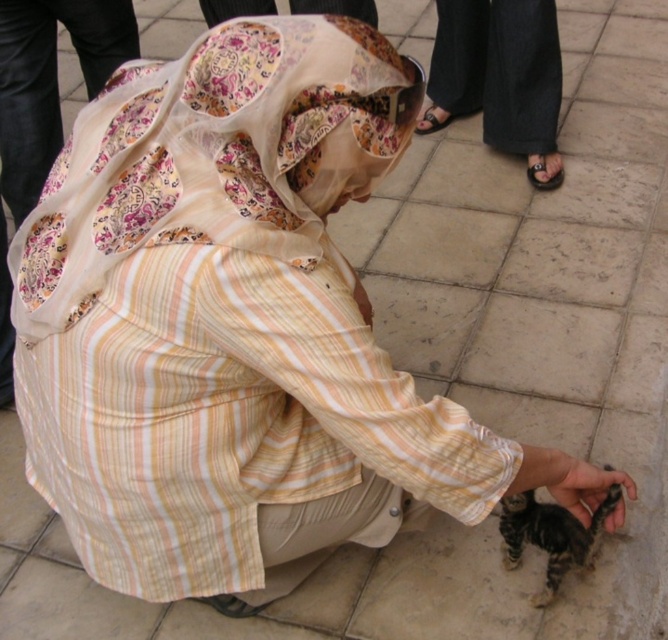
Which of these two, black cotton pants at upper center or soft fur paw at lower right, stands shorter?

soft fur paw at lower right is shorter.

Which is more to the left, black cotton pants at upper center or soft fur paw at lower right?

Positioned to the left is soft fur paw at lower right.

Is point (516, 129) farther from viewer compared to point (623, 477)?

Yes, it is behind point (623, 477).

Locate an element on the screen. The image size is (668, 640). black cotton pants at upper center is located at coordinates (498, 70).

Does point (566, 536) lie in front of point (587, 506)?

Yes, point (566, 536) is in front of point (587, 506).

Describe the element at coordinates (550, 536) in the screenshot. I see `striped fur kitten at lower right` at that location.

At what (x,y) coordinates should I click in order to perform the action: click on striped fur kitten at lower right. Please return your answer as a coordinate pair (x, y). The image size is (668, 640). Looking at the image, I should click on (550, 536).

Is point (442, 106) in front of point (548, 154)?

No, it is behind (548, 154).

Between black cotton pants at upper center and black leather sandal at lower right, which one is positioned higher?

black cotton pants at upper center is higher up.

Between point (462, 60) and point (554, 154), which one is positioned behind?

Positioned behind is point (462, 60).

Identify the location of black cotton pants at upper center. (498, 70).